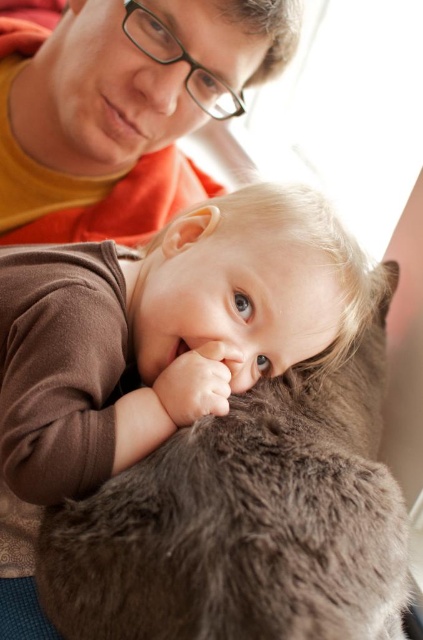
Question: Which point is closer to the camera?

Choices:
 (A) (46, 556)
 (B) (74, 88)

Answer: (A)

Question: Does fuzzy brown cat at center appear on the right side of matte orange shirt at upper left?

Choices:
 (A) no
 (B) yes

Answer: (B)

Question: Is the position of fuzzy brown cat at center less distant than that of matte orange shirt at upper left?

Choices:
 (A) no
 (B) yes

Answer: (B)

Question: Does fuzzy brown cat at center appear over matte orange shirt at upper left?

Choices:
 (A) no
 (B) yes

Answer: (A)

Question: Which point is closer to the camera?

Choices:
 (A) matte orange shirt at upper left
 (B) fuzzy brown cat at center

Answer: (B)

Question: Which point is farther from the camera taking this photo?

Choices:
 (A) (49, 131)
 (B) (216, 592)

Answer: (A)